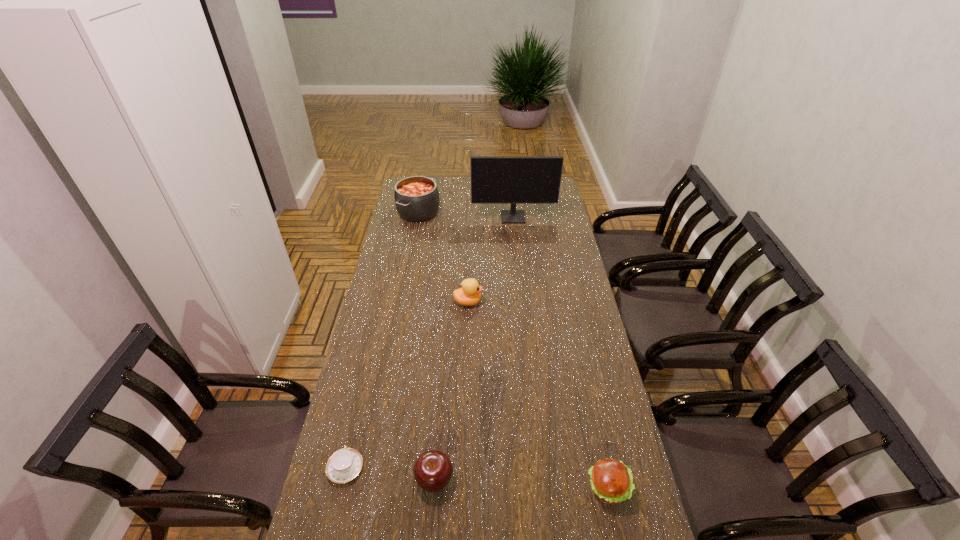
Where is `computer monitor`? computer monitor is located at coordinates (513, 180).

What are the coordinates of `casserole` in the screenshot? It's located at (416, 198).

This screenshot has height=540, width=960. I want to click on the third farthest object, so click(469, 294).

Find the location of `apple`. apple is located at coordinates (433, 470).

At what (x,y) coordinates should I click in order to perform the action: click on hamburger. Please return your answer as a coordinate pair (x, y). This screenshot has width=960, height=540. Looking at the image, I should click on (611, 481).

The height and width of the screenshot is (540, 960). I want to click on the shortest object, so click(x=345, y=464).

Where is `vacant space located on the front-facing side of the computer monitor`? vacant space located on the front-facing side of the computer monitor is located at coordinates (515, 232).

Where is `vacant space located on the right of the casserole`? This screenshot has height=540, width=960. vacant space located on the right of the casserole is located at coordinates (469, 212).

You are a GUI agent. You are given a task and a screenshot of the screen. Output one action in this format:
    pyautogui.click(x=<x>, y=<y>)
    Task: Click on the free space located 0.340m on the face of the fourth nearest object
    The image size is (960, 540).
    Given the screenshot: What is the action you would take?
    pyautogui.click(x=566, y=302)

Where is `vacant region located on the right of the apple`? The height and width of the screenshot is (540, 960). vacant region located on the right of the apple is located at coordinates (511, 480).